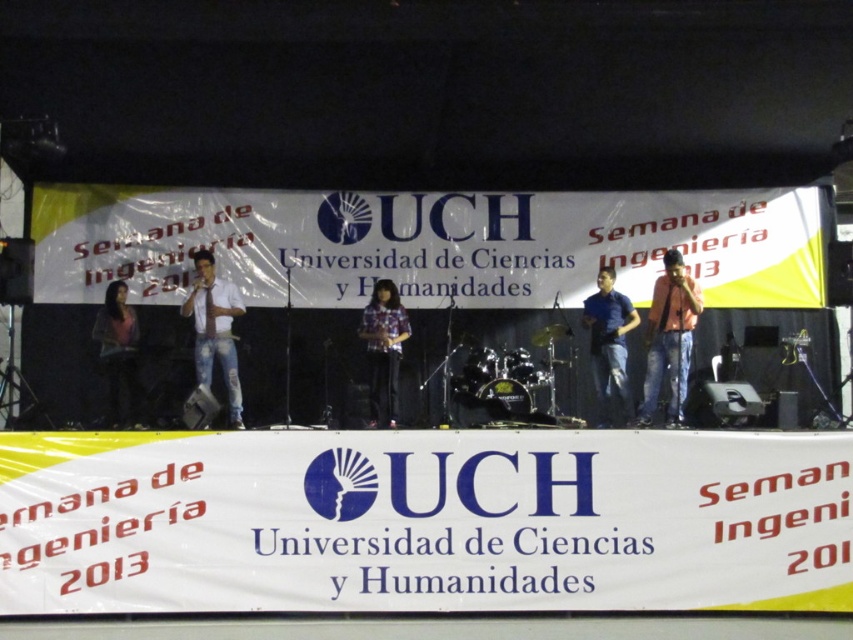
You are a photographer positioned at the back of the stage. You need to capture a photo that includes both the blue denim jeans at center and the matte black dress at left. Given that your camera has a maximum focus range of 5 meters, will you be able to focus on both subjects simultaneously?

The blue denim jeans at center is 5.04 meters from the matte black dress at left. Since the distance between them exceeds the camera maximum focus range of 5 meters, you cannot focus on both subjects simultaneously.

You are a photographer at the event and need to capture a photo of the matte black shirt at right and the white denim jeans at center. Based on their positions, which object is located more to the right?

The matte black shirt at right is positioned on the right side of white denim jeans at center, so the matte black shirt at right is more to the right.

You are standing at the front of the stage during the event. You notice two points marked on the stage floor. The first point is at coordinate point(601,273) and the second is at point(122,282). If you want to move from the first point to the second, which direction should you face to walk directly towards it?

Since point(601,273) is behind point(122,282), you should face forward to walk directly towards the second point from the first point.